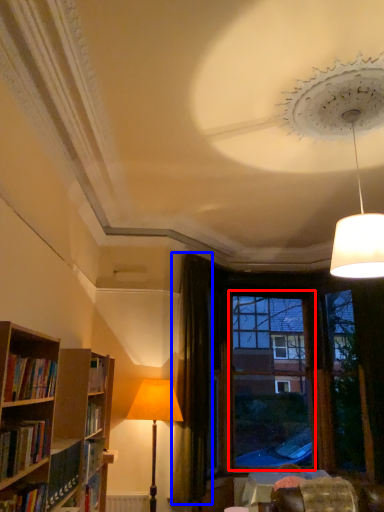
Question: Which of the following is the farthest to the observer, window frame (highlighted by a red box) or curtain (highlighted by a blue box)?

Choices:
 (A) window frame
 (B) curtain

Answer: (A)